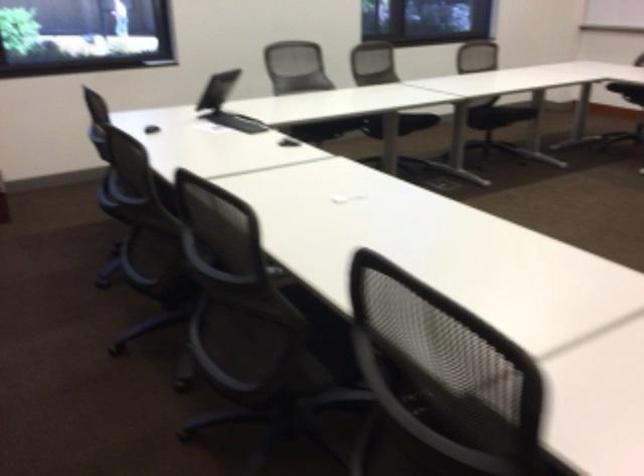
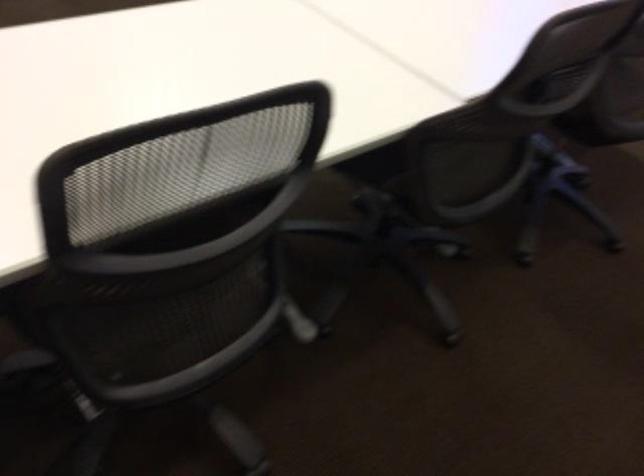
Question: What movement of the cameraman would produce the second image?

Choices:
 (A) Left
 (B) Right
 (C) Forward
 (D) Backward

Answer: (D)